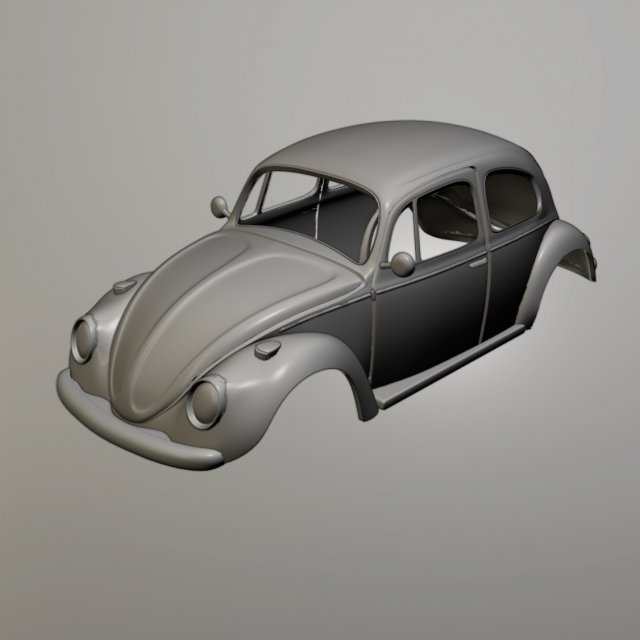
Find the location of a particular element. The height and width of the screenshot is (640, 640). side lights is located at coordinates (401, 257), (219, 204).